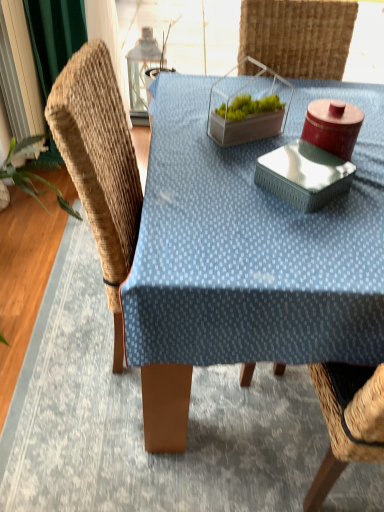
Question: Does woven wood swivel chair at left have a greater height compared to blue fabric table at center?

Choices:
 (A) yes
 (B) no

Answer: (A)

Question: Is woven wood swivel chair at left bigger than blue fabric table at center?

Choices:
 (A) no
 (B) yes

Answer: (A)

Question: Is woven wood swivel chair at left thinner than blue fabric table at center?

Choices:
 (A) yes
 (B) no

Answer: (A)

Question: From the image's perspective, is woven wood swivel chair at left under blue fabric table at center?

Choices:
 (A) yes
 (B) no

Answer: (B)

Question: Is woven wood swivel chair at left not inside blue fabric table at center?

Choices:
 (A) yes
 (B) no

Answer: (B)

Question: Is blue fabric table at center inside woven wood swivel chair at left?

Choices:
 (A) yes
 (B) no

Answer: (B)

Question: Are blue fabric table at center and woven wood swivel chair at left beside each other?

Choices:
 (A) yes
 (B) no

Answer: (B)

Question: From the image's perspective, does blue fabric table at center appear higher than woven wood swivel chair at left?

Choices:
 (A) yes
 (B) no

Answer: (B)

Question: Can you confirm if blue fabric table at center is shorter than woven wood swivel chair at left?

Choices:
 (A) no
 (B) yes

Answer: (B)

Question: Is blue fabric table at center positioned beyond the bounds of woven wood swivel chair at left?

Choices:
 (A) no
 (B) yes

Answer: (B)

Question: Is blue fabric table at center taller than woven wood swivel chair at left?

Choices:
 (A) no
 (B) yes

Answer: (A)

Question: From the image's perspective, does blue fabric table at center appear lower than woven wood swivel chair at left?

Choices:
 (A) yes
 (B) no

Answer: (A)

Question: Is point (100, 186) closer or farther from the camera than point (339, 311)?

Choices:
 (A) farther
 (B) closer

Answer: (A)